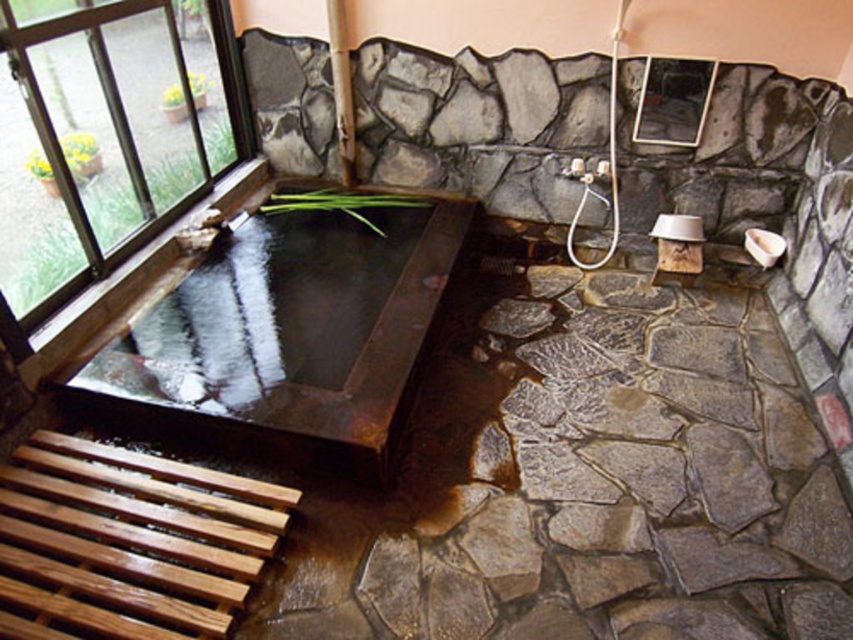
Describe the element at coordinates (287, 337) in the screenshot. I see `rusty metal tub at center` at that location.

Between rusty metal tub at center and clear glass window at upper left, which one has more height?

With more height is clear glass window at upper left.

Is point (305, 294) less distant than point (183, 145)?

Yes.

Image resolution: width=853 pixels, height=640 pixels. Identify the location of rusty metal tub at center. pos(287,337).